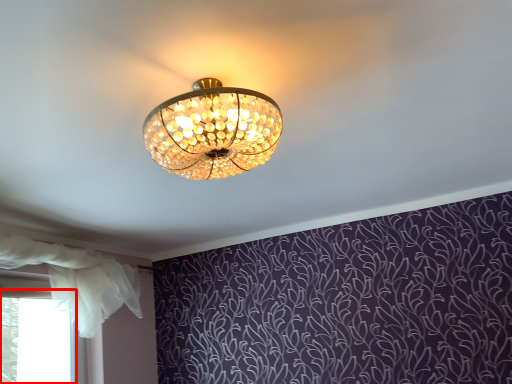
Question: In this image, where is bay window (annotated by the red box) located relative to curtain?

Choices:
 (A) left
 (B) right

Answer: (A)